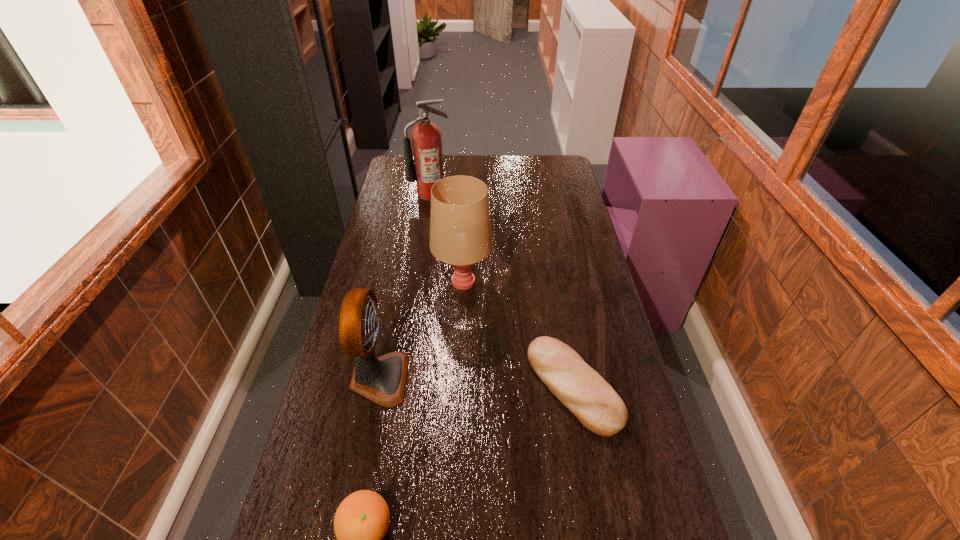
Where is `vacant region that satisfies the following two spatial constraints: 1. on the front side of the fourth nearest object; 2. on the front-facing side of the fan`? vacant region that satisfies the following two spatial constraints: 1. on the front side of the fourth nearest object; 2. on the front-facing side of the fan is located at coordinates (459, 379).

Locate an element on the screen. The height and width of the screenshot is (540, 960). free point that satisfies the following two spatial constraints: 1. on the front side of the rightmost object; 2. on the left side of the fourth nearest object is located at coordinates (458, 386).

The height and width of the screenshot is (540, 960). Find the location of `free region that satisfies the following two spatial constraints: 1. on the front of the farthest object near the operation label; 2. on the front-facing side of the fan`. free region that satisfies the following two spatial constraints: 1. on the front of the farthest object near the operation label; 2. on the front-facing side of the fan is located at coordinates [403, 379].

Find the location of a particular element. The width and height of the screenshot is (960, 540). free location that satisfies the following two spatial constraints: 1. on the front of the farthest object near the operation label; 2. on the front-facing side of the fan is located at coordinates (403, 379).

This screenshot has height=540, width=960. What are the coordinates of `vacant point that satisfies the following two spatial constraints: 1. on the front of the fire extinguisher near the operation label; 2. on the right side of the shortest object` in the screenshot? It's located at (402, 386).

You are a GUI agent. You are given a task and a screenshot of the screen. Output one action in this format:
    pyautogui.click(x=<x>, y=<y>)
    Task: Click on the free location that satisfies the following two spatial constraints: 1. on the front of the shortest object near the operation label; 2. on the left side of the fire extinguisher
    This screenshot has height=540, width=960.
    Given the screenshot: What is the action you would take?
    pyautogui.click(x=402, y=386)